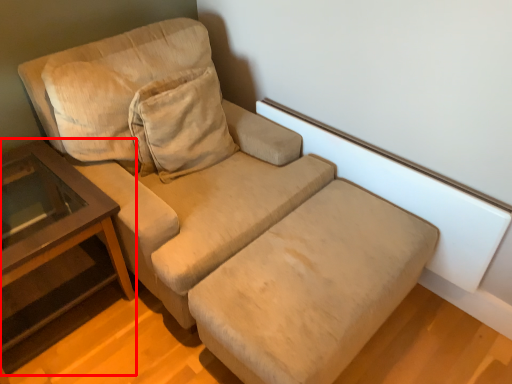
Question: Considering the relative positions of table (annotated by the red box) and footrest in the image provided, where is table (annotated by the red box) located with respect to the staircase?

Choices:
 (A) left
 (B) right

Answer: (A)